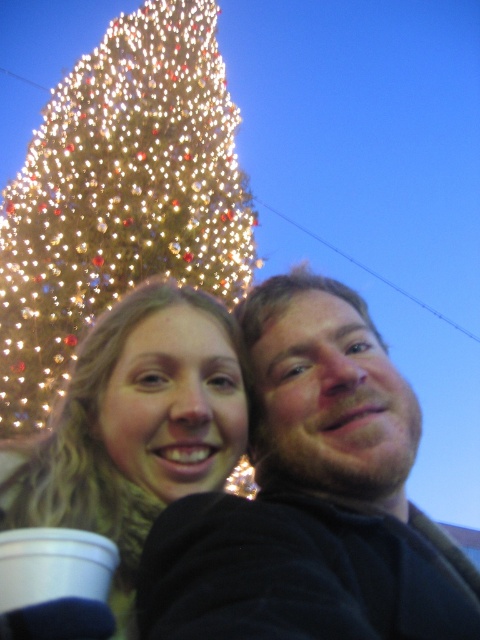
Question: Based on their relative distances, which object is farther from the white paper cup at lower left?

Choices:
 (A) dark brown hair at center
 (B) illuminated glass christmas tree at upper left
 (C) matte black hair at center

Answer: (B)

Question: Which point is closer to the camera?

Choices:
 (A) (464, 627)
 (B) (32, 300)

Answer: (A)

Question: Is dark brown hair at center to the right of matte black hair at center from the viewer's perspective?

Choices:
 (A) yes
 (B) no

Answer: (A)

Question: Can you confirm if dark brown hair at center is positioned to the left of white paper cup at lower left?

Choices:
 (A) yes
 (B) no

Answer: (B)

Question: Does dark brown hair at center lie in front of illuminated glass christmas tree at upper left?

Choices:
 (A) no
 (B) yes

Answer: (B)

Question: Estimate the real-world distances between objects in this image. Which object is farther from the illuminated glass christmas tree at upper left?

Choices:
 (A) dark brown hair at center
 (B) white paper cup at lower left
 (C) matte black hair at center

Answer: (A)